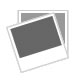
This screenshot has height=80, width=80. What are the coordinates of `picture` in the screenshot? It's located at (28, 45), (61, 24).